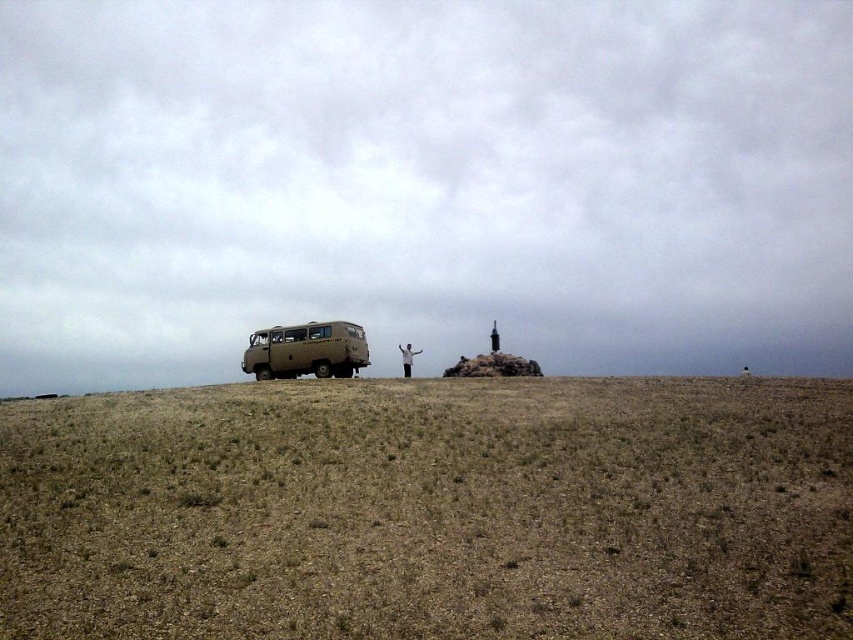
Consider the image. Which is below, brown dry grass at center or white matte person at center?

brown dry grass at center

Is brown dry grass at center bigger than white matte person at center?

Correct, brown dry grass at center is larger in size than white matte person at center.

Find the location of a particular element. The width and height of the screenshot is (853, 640). brown dry grass at center is located at coordinates (431, 512).

Who is positioned more to the left, beige matte van at left or white matte person at center?

Positioned to the left is beige matte van at left.

Who is more forward, (x=354, y=356) or (x=408, y=355)?

Point (x=354, y=356) is in front.

Which is in front, point (276, 342) or point (416, 352)?

Point (276, 342) is in front.

Find the location of a particular element. beige matte van at left is located at coordinates (306, 349).

Is brown dry grass at center below beige matte van at left?

Yes.

Is brown dry grass at center to the right of beige matte van at left from the viewer's perspective?

Yes, brown dry grass at center is to the right of beige matte van at left.

The height and width of the screenshot is (640, 853). What do you see at coordinates (431, 512) in the screenshot? I see `brown dry grass at center` at bounding box center [431, 512].

Identify the location of brown dry grass at center. (431, 512).